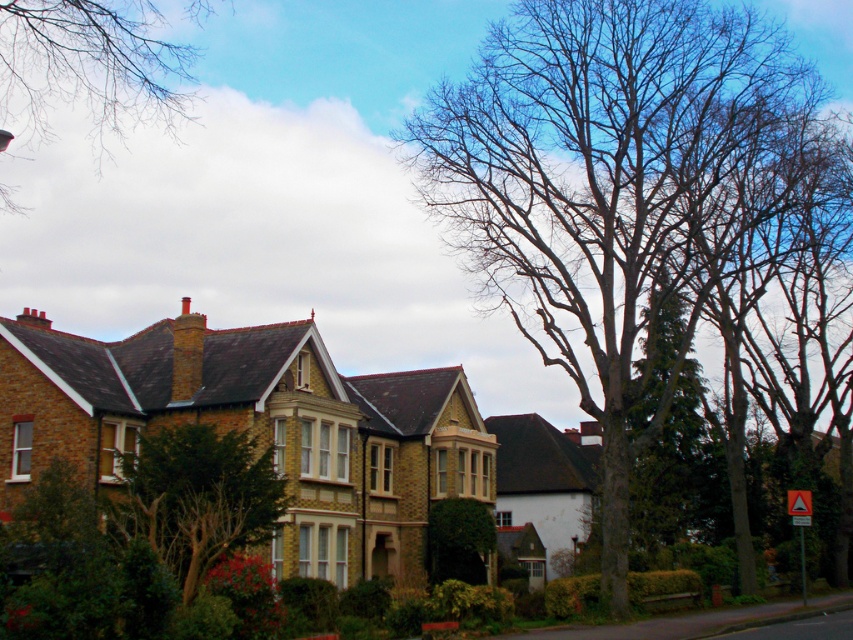
In the scene shown: Who is more distant from viewer, (177, 77) or (219, 488)?

The point (177, 77) is more distant.

The height and width of the screenshot is (640, 853). What do you see at coordinates (90, 67) in the screenshot?
I see `bare branches at upper left` at bounding box center [90, 67].

Find the location of a particular element. This screenshot has width=853, height=640. bare branches at upper left is located at coordinates (90, 67).

Is bare wood tree at upper center shorter than yellow reflective triangle at lower right?

Incorrect, bare wood tree at upper center's height does not fall short of yellow reflective triangle at lower right's.

Is point (622, 387) closer to camera compared to point (802, 524)?

That is True.

At what (x,y) coordinates should I click in order to perform the action: click on bare wood tree at upper center. Please return your answer as a coordinate pair (x, y). This screenshot has width=853, height=640. Looking at the image, I should click on (613, 193).

Can you confirm if bare branches at upper left is positioned above yellow reflective triangle at lower right?

Indeed, bare branches at upper left is positioned over yellow reflective triangle at lower right.

Looking at this image, which is more to the right, bare branches at upper left or yellow reflective triangle at lower right?

Positioned to the right is yellow reflective triangle at lower right.

Locate an element on the screen. This screenshot has height=640, width=853. bare branches at upper left is located at coordinates (90, 67).